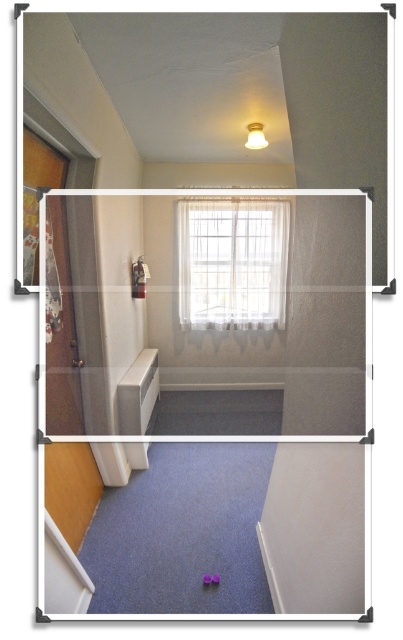
You are organizing a childrens party in the room shown. You need to place a large poster on the wall. Which object, the sheer white curtain at center or the purple rubber toy at lower center, should you avoid covering to ensure there is enough space for the poster?

You should avoid covering the sheer white curtain at center because it is bigger than the purple rubber toy at lower center, providing more space for the poster.